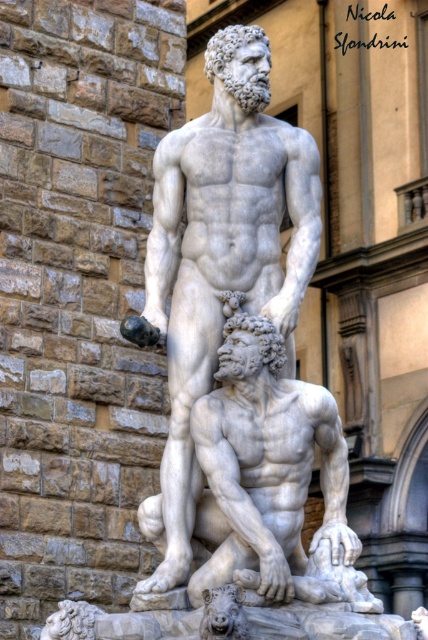
Which is above, white marble statue at center or white marble man at center?

white marble statue at center is higher up.

Is point (151, 241) behind point (213, 410)?

Yes, point (151, 241) is behind point (213, 410).

Find the location of a particular element. The image size is (428, 640). white marble statue at center is located at coordinates (222, 252).

You are a GUI agent. You are given a task and a screenshot of the screen. Output one action in this format:
    pyautogui.click(x=<x>, y=<y>)
    Task: Click on the white marble statue at center
    The image size is (428, 640).
    Given the screenshot: What is the action you would take?
    pyautogui.click(x=222, y=252)